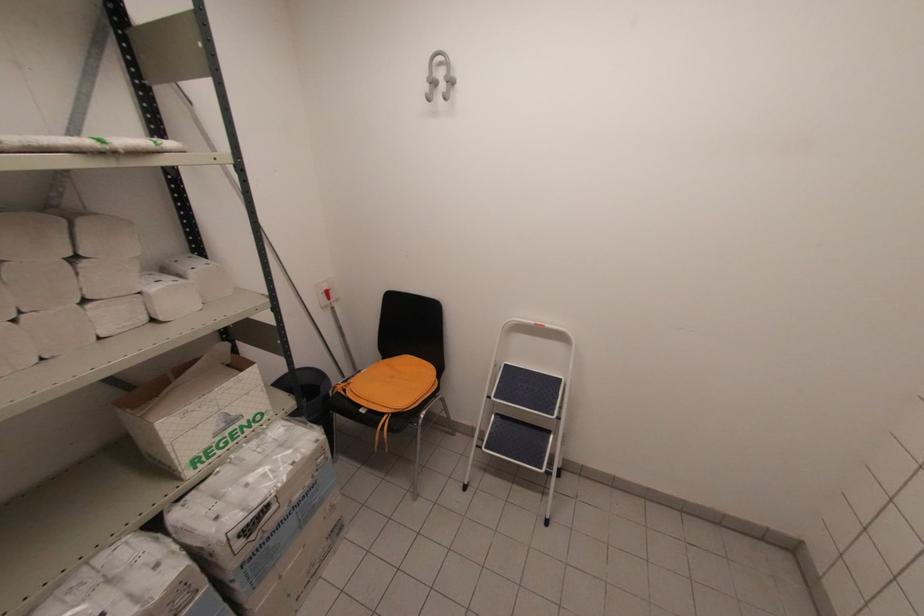
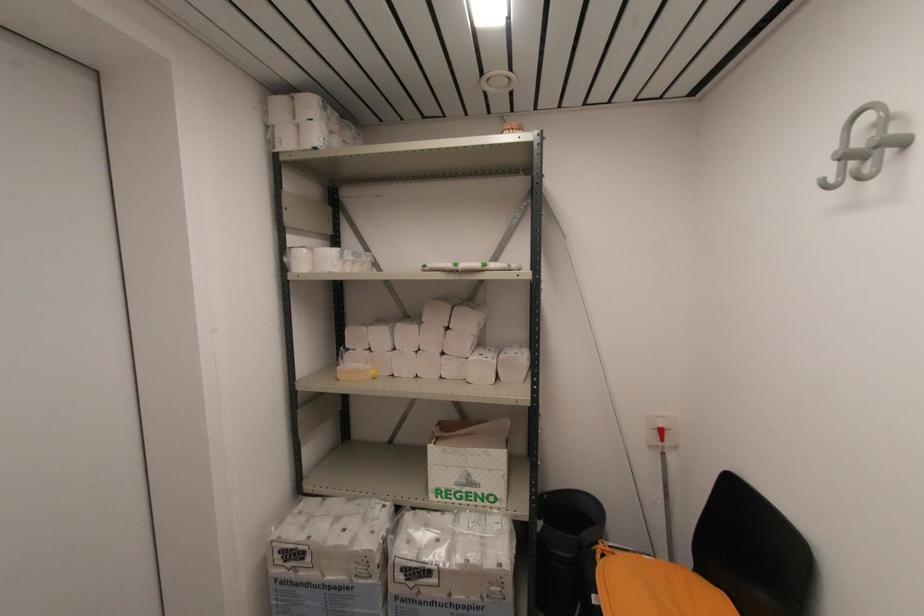
Locate, in the second image, the point that corresponds to the point at 330,299 in the first image.

(663, 439)